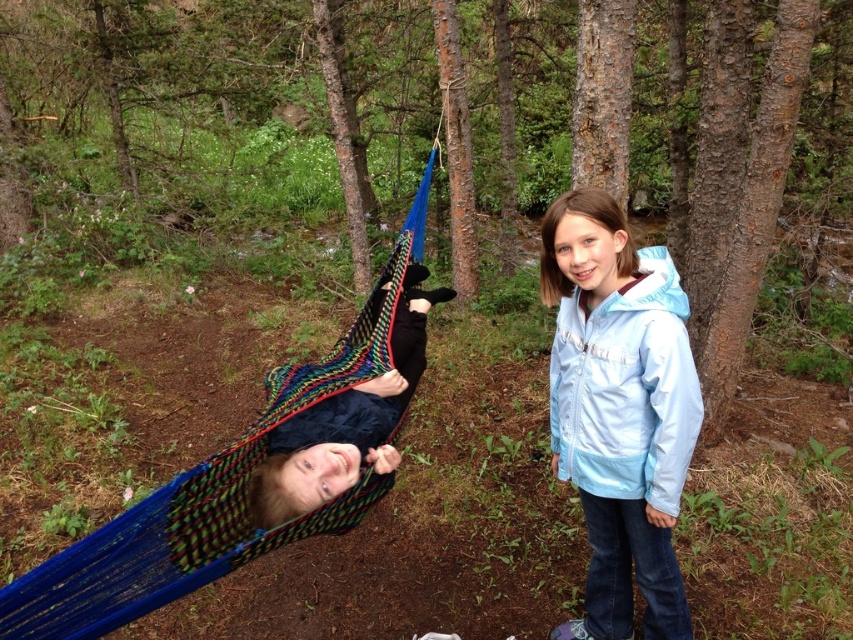
You are a photographer trying to capture the light blue fabric jacket at center in the image. If you want to focus on the jacket, which direction should you move your camera? The camera is currently positioned to the left of the jacket.

The light blue fabric jacket at center is located at point coordinates of (x=619, y=410). Since the camera is to the left of the jacket, moving it to the right would bring the jacket into focus.

You are standing at the point marked as point (274, 449) in the forest scene. You want to toss a small stone to the young girl on the right side of the frame. Can you reach her from that point with a throw of 2.5 meters?

The distance between point (274, 449) and the viewer is 2.36 meters. Since the throw distance of 2.5 meters is slightly longer than the 2.36 meters, you can reach the young girl on the right side of the frame.

You are a photographer trying to capture both the light blue fabric jacket at center and the multicolored knitted hammock at center in the same frame. Based on their positions, which object will appear closer to the camera in the photo?

The light blue fabric jacket at center will appear closer to the camera because it is further to the viewer than the multicolored knitted hammock at center.